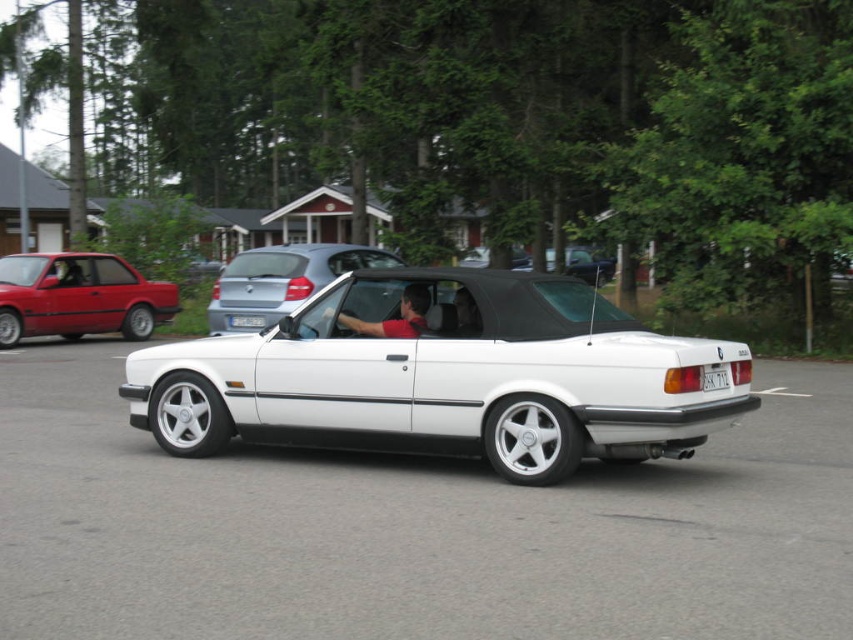
You are standing in front of the white BMW convertible and want to determine the relative positions of two points on the car. The first point is at coordinates point (74, 257) and the second point is at point (277, 280). Which point is closer to you?

Point (74, 257) is closer to you because it is further to the viewer than point (277, 280).